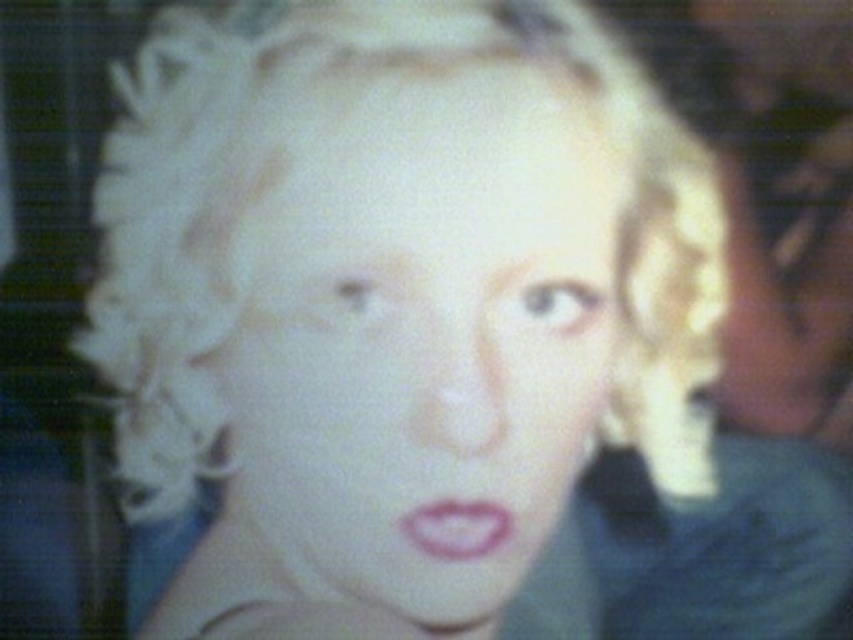
Is smooth skin face at center positioned at the back of pink matte lips at center?

No, it is in front of pink matte lips at center.

Can you confirm if smooth skin face at center is bigger than pink matte lips at center?

Indeed, smooth skin face at center has a larger size compared to pink matte lips at center.

Identify the location of smooth skin face at center. This screenshot has width=853, height=640. (422, 333).